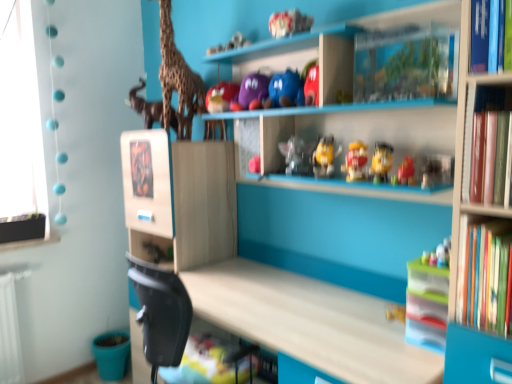
Question: Would you say translucent plastic toy at center, the 2th toy in the bottom-to-top sequence, is outside matte purple plush at upper center, which appears as the first toy when viewed from the top?

Choices:
 (A) yes
 (B) no

Answer: (A)

Question: From the image's perspective, is translucent plastic toy at center, which ranks as the fifth toy in top-to-bottom order, on matte purple plush at upper center, acting as the 6th toy starting from the bottom?

Choices:
 (A) no
 (B) yes

Answer: (A)

Question: Is translucent plastic toy at center, the 2th toy in the bottom-to-top sequence, not near matte purple plush at upper center, which appears as the first toy when viewed from the top?

Choices:
 (A) no
 (B) yes

Answer: (A)

Question: Can you confirm if translucent plastic toy at center, which ranks as the fifth toy in top-to-bottom order, is wider than matte purple plush at upper center, which appears as the first toy when viewed from the top?

Choices:
 (A) yes
 (B) no

Answer: (A)

Question: Is translucent plastic toy at center, the 2th toy in the bottom-to-top sequence, looking in the opposite direction of matte purple plush at upper center, acting as the 6th toy starting from the bottom?

Choices:
 (A) no
 (B) yes

Answer: (A)

Question: Is yellow matte toy at center, which is counted as the third toy, starting from the bottom, bigger or smaller than translucent plastic figurine at center, the fourth toy when ordered from bottom to top?

Choices:
 (A) small
 (B) big

Answer: (A)

Question: From the image's perspective, is yellow matte toy at center, the fourth toy positioned from the top, positioned above or below translucent plastic figurine at center, the 3th toy positioned from the top?

Choices:
 (A) below
 (B) above

Answer: (A)

Question: In terms of width, does yellow matte toy at center, which is counted as the third toy, starting from the bottom, look wider or thinner when compared to translucent plastic figurine at center, the 3th toy positioned from the top?

Choices:
 (A) wide
 (B) thin

Answer: (B)

Question: From their relative heights in the image, would you say yellow matte toy at center, the fourth toy positioned from the top, is taller or shorter than translucent plastic figurine at center, the 3th toy positioned from the top?

Choices:
 (A) short
 (B) tall

Answer: (A)

Question: From their relative heights in the image, would you say matte yellow toy at center, arranged as the sixth toy when viewed from the top, is taller or shorter than matte purple plush at upper center, acting as the 6th toy starting from the bottom?

Choices:
 (A) tall
 (B) short

Answer: (B)

Question: From a real-world perspective, relative to matte purple plush at upper center, which appears as the first toy when viewed from the top, is matte yellow toy at center, arranged as the sixth toy when viewed from the top, vertically above or below?

Choices:
 (A) below
 (B) above

Answer: (A)

Question: Looking at the image, does matte yellow toy at center, arranged as the sixth toy when viewed from the top, seem bigger or smaller compared to matte purple plush at upper center, acting as the 6th toy starting from the bottom?

Choices:
 (A) big
 (B) small

Answer: (B)

Question: Is matte yellow toy at center, which is the 1th toy from bottom to top, to the left or to the right of matte purple plush at upper center, acting as the 6th toy starting from the bottom, in the image?

Choices:
 (A) left
 (B) right

Answer: (B)

Question: From the image's perspective, relative to hardcover books at right, is wooden giraffe at upper left above or below?

Choices:
 (A) below
 (B) above

Answer: (B)

Question: Would you say wooden giraffe at upper left is to the left or to the right of hardcover books at right in the picture?

Choices:
 (A) right
 (B) left

Answer: (B)